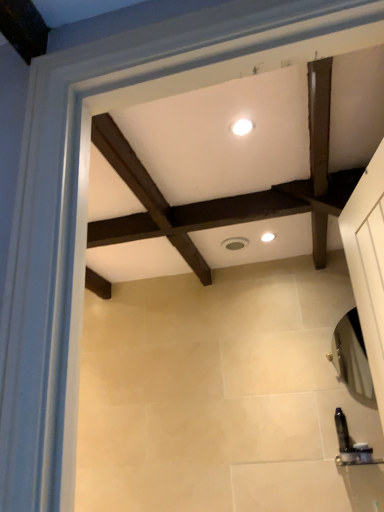
Describe the element at coordinates (363, 453) in the screenshot. I see `translucent plastic soap dispenser at lower right, which is the first toiletry from right to left` at that location.

Find the location of a particular element. black plastic toiletry at lower right, acting as the 2th toiletry starting from the right is located at coordinates (342, 431).

Measure the distance between white glossy light fixture at center, which is the 1th lighting from right to left, and camera.

A distance of 2.04 meters exists between white glossy light fixture at center, which is the 1th lighting from right to left, and camera.

Find the location of a particular element. translucent plastic soap dispenser at lower right, which is the first toiletry from right to left is located at coordinates coord(363,453).

At what (x,y) coordinates should I click in order to perform the action: click on the 1st toiletry in front of the white glossy light fixture at center, which is counted as the 1th lighting, starting from the back, counting from the anchor's position. Please return your answer as a coordinate pair (x, y). Looking at the image, I should click on (342, 431).

Considering the sizes of black plastic toiletry at lower right, acting as the 2th toiletry starting from the right, and white glossy light fixture at center, which is the 1th lighting from right to left, in the image, is black plastic toiletry at lower right, acting as the 2th toiletry starting from the right, taller or shorter than white glossy light fixture at center, which is the 1th lighting from right to left,?

In the image, black plastic toiletry at lower right, acting as the 2th toiletry starting from the right, appears to be taller than white glossy light fixture at center, which is the 1th lighting from right to left.

From a real-world perspective, is black plastic toiletry at lower right, acting as the 1th toiletry starting from the left, physically located above or below white glossy light fixture at center, the 1th lighting when ordered from bottom to top?

black plastic toiletry at lower right, acting as the 1th toiletry starting from the left, is below white glossy light fixture at center, the 1th lighting when ordered from bottom to top.

Is white glossy light fixture at center, the second lighting when ordered from top to bottom, completely or partially inside translucent plastic soap dispenser at lower right, which is the first toiletry from right to left?

Definitely not — white glossy light fixture at center, the second lighting when ordered from top to bottom, is not inside translucent plastic soap dispenser at lower right, which is the first toiletry from right to left.

Does translucent plastic soap dispenser at lower right, which is the first toiletry from right to left, have a lesser width compared to white glossy light fixture at center, which is the 1th lighting from right to left?

Yes.

Is white glossy light fixture at upper center, acting as the first lighting starting from the front, not near white glossy light fixture at center, the second lighting from the left?

No, there isn't a large distance between white glossy light fixture at upper center, acting as the first lighting starting from the front, and white glossy light fixture at center, the second lighting from the left.

In order to click on lighting in front of the white glossy light fixture at center, the 1th lighting when ordered from bottom to top in this screenshot , I will do `click(242, 127)`.

From a real-world perspective, which object rests below the other?

From a 3D spatial view, white glossy light fixture at center, the second lighting from the left, is below.

From the image's perspective, between white glossy light fixture at upper center, the 2th lighting from the right, and white glossy light fixture at center, the second lighting viewed from the front, which one is located above?

From the image's view, white glossy light fixture at upper center, the 2th lighting from the right, is above.

Between black plastic toiletry at lower right, acting as the 2th toiletry starting from the right, and translucent plastic soap dispenser at lower right, which is the first toiletry from right to left, which one appears on the left side from the viewer's perspective?

From the viewer's perspective, black plastic toiletry at lower right, acting as the 2th toiletry starting from the right, appears more on the left side.

From a real-world perspective, is black plastic toiletry at lower right, acting as the 2th toiletry starting from the right, positioned above or below translucent plastic soap dispenser at lower right, which is the first toiletry from right to left?

black plastic toiletry at lower right, acting as the 2th toiletry starting from the right, is situated higher than translucent plastic soap dispenser at lower right, which is the first toiletry from right to left, in the real world.

What's the angular difference between black plastic toiletry at lower right, acting as the 1th toiletry starting from the left, and white glossy light fixture at upper center, the second lighting in the bottom-to-top sequence,'s facing directions?

They differ by 0.463 degrees in their facing directions.

Which is in front, point (336, 421) or point (239, 129)?

The point (239, 129) is in front.

Is black plastic toiletry at lower right, acting as the 2th toiletry starting from the right, situated inside white glossy light fixture at upper center, the 2th lighting from the right, or outside?

black plastic toiletry at lower right, acting as the 2th toiletry starting from the right, is not inside white glossy light fixture at upper center, the 2th lighting from the right, it's outside.

Between black plastic toiletry at lower right, acting as the 2th toiletry starting from the right, and white glossy light fixture at upper center, placed as the 1th lighting when sorted from top to bottom, which one appears on the right side from the viewer's perspective?

From the viewer's perspective, black plastic toiletry at lower right, acting as the 2th toiletry starting from the right, appears more on the right side.

Considering the relative sizes of white glossy light fixture at center, which is the 1th lighting from right to left, and black plastic toiletry at lower right, acting as the 1th toiletry starting from the left, in the image provided, is white glossy light fixture at center, which is the 1th lighting from right to left, shorter than black plastic toiletry at lower right, acting as the 1th toiletry starting from the left,?

Indeed, white glossy light fixture at center, which is the 1th lighting from right to left, has a lesser height compared to black plastic toiletry at lower right, acting as the 1th toiletry starting from the left.

Is white glossy light fixture at center, which is counted as the 1th lighting, starting from the back, wider or thinner than black plastic toiletry at lower right, acting as the 1th toiletry starting from the left?

white glossy light fixture at center, which is counted as the 1th lighting, starting from the back, is wider than black plastic toiletry at lower right, acting as the 1th toiletry starting from the left.

From the image's perspective, is white glossy light fixture at center, the second lighting viewed from the front, on black plastic toiletry at lower right, acting as the 1th toiletry starting from the left?

Yes, from the image's perspective, white glossy light fixture at center, the second lighting viewed from the front, is on top of black plastic toiletry at lower right, acting as the 1th toiletry starting from the left.

This screenshot has height=512, width=384. Find the location of `toiletry that is the 1st one below the white glossy light fixture at center, the second lighting viewed from the front (from a real-world perspective)`. toiletry that is the 1st one below the white glossy light fixture at center, the second lighting viewed from the front (from a real-world perspective) is located at coordinates (342, 431).

From the image's perspective, is white glossy light fixture at center, which is the 1th lighting from right to left, on white glossy light fixture at upper center, the second lighting in the back-to-front sequence?

No.

Is white glossy light fixture at upper center, acting as the first lighting starting from the front, a part of white glossy light fixture at center, which is counted as the 1th lighting, starting from the back?

That's incorrect, white glossy light fixture at upper center, acting as the first lighting starting from the front, is not inside white glossy light fixture at center, which is counted as the 1th lighting, starting from the back.

I want to click on lighting in front of the white glossy light fixture at center, the second lighting viewed from the front, so (x=242, y=127).

Is white glossy light fixture at center, the second lighting when ordered from top to bottom, looking in the opposite direction of white glossy light fixture at upper center, positioned as the 1th lighting in left-to-right order?

That's not correct — white glossy light fixture at center, the second lighting when ordered from top to bottom, is not looking away from white glossy light fixture at upper center, positioned as the 1th lighting in left-to-right order.

The image size is (384, 512). Identify the location of toiletry that is the 1st object directly below the white glossy light fixture at center, the second lighting when ordered from top to bottom (from a real-world perspective). (342, 431).

Which toiletry is the 2nd one when counting from the front of the white glossy light fixture at center, which is counted as the 1th lighting, starting from the back? Please provide its 2D coordinates.

[(363, 453)]

Considering their positions, is black plastic toiletry at lower right, acting as the 2th toiletry starting from the right, positioned closer to white glossy light fixture at upper center, positioned as the 1th lighting in left-to-right order, than translucent plastic soap dispenser at lower right, which appears as the 2th toiletry when viewed from the left?

black plastic toiletry at lower right, acting as the 2th toiletry starting from the right, is positioned closer to the anchor white glossy light fixture at upper center, positioned as the 1th lighting in left-to-right order.

Considering their positions, is white glossy light fixture at center, the second lighting from the left, positioned further to translucent plastic soap dispenser at lower right, which is the first toiletry from right to left, than white glossy light fixture at upper center, the second lighting in the back-to-front sequence?

white glossy light fixture at upper center, the second lighting in the back-to-front sequence, is further to translucent plastic soap dispenser at lower right, which is the first toiletry from right to left.

When comparing their distances from white glossy light fixture at upper center, placed as the 1th lighting when sorted from top to bottom, does black plastic toiletry at lower right, acting as the 2th toiletry starting from the right, or white glossy light fixture at center, which is counted as the 1th lighting, starting from the back, seem closer?

white glossy light fixture at center, which is counted as the 1th lighting, starting from the back, lies closer to white glossy light fixture at upper center, placed as the 1th lighting when sorted from top to bottom, than the other object.

Based on the photo, estimate the real-world distances between objects in this image. Which object is closer to black plastic toiletry at lower right, acting as the 2th toiletry starting from the right, white glossy light fixture at center, the second lighting from the left, or translucent plastic soap dispenser at lower right, which is the first toiletry from right to left?

translucent plastic soap dispenser at lower right, which is the first toiletry from right to left.

When comparing their distances from translucent plastic soap dispenser at lower right, which appears as the 2th toiletry when viewed from the left, does black plastic toiletry at lower right, acting as the 1th toiletry starting from the left, or white glossy light fixture at upper center, the second lighting in the bottom-to-top sequence, seem further?

The object further to translucent plastic soap dispenser at lower right, which appears as the 2th toiletry when viewed from the left, is white glossy light fixture at upper center, the second lighting in the bottom-to-top sequence.

Based on their spatial positions, is black plastic toiletry at lower right, acting as the 1th toiletry starting from the left, or translucent plastic soap dispenser at lower right, which appears as the 2th toiletry when viewed from the left, closer to white glossy light fixture at center, the second lighting from the left?

The object closer to white glossy light fixture at center, the second lighting from the left, is black plastic toiletry at lower right, acting as the 1th toiletry starting from the left.

Based on their spatial positions, is white glossy light fixture at upper center, the second lighting in the back-to-front sequence, or white glossy light fixture at center, the second lighting from the left, closer to translucent plastic soap dispenser at lower right, which is the first toiletry from right to left?

Based on the image, white glossy light fixture at center, the second lighting from the left, appears to be nearer to translucent plastic soap dispenser at lower right, which is the first toiletry from right to left.

Based on their spatial positions, is white glossy light fixture at upper center, the second lighting in the back-to-front sequence, or translucent plastic soap dispenser at lower right, which is the first toiletry from right to left, further from white glossy light fixture at center, which is counted as the 1th lighting, starting from the back?

translucent plastic soap dispenser at lower right, which is the first toiletry from right to left, is positioned further to the anchor white glossy light fixture at center, which is counted as the 1th lighting, starting from the back.

Locate an element on the screen. This screenshot has width=384, height=512. toiletry that lies between white glossy light fixture at upper center, the second lighting in the back-to-front sequence, and translucent plastic soap dispenser at lower right, which appears as the 2th toiletry when viewed from the left, from top to bottom is located at coordinates (342, 431).

Identify the location of toiletry between white glossy light fixture at center, the 1th lighting when ordered from bottom to top, and translucent plastic soap dispenser at lower right, which appears as the 2th toiletry when viewed from the left, in the up-down direction. (342, 431).

The height and width of the screenshot is (512, 384). What are the coordinates of `lighting between white glossy light fixture at upper center, the second lighting in the back-to-front sequence, and black plastic toiletry at lower right, acting as the 1th toiletry starting from the left, in the up-down direction` in the screenshot? It's located at (268, 237).

Locate an element on the screen. The width and height of the screenshot is (384, 512). lighting between white glossy light fixture at upper center, placed as the 1th lighting when sorted from top to bottom, and translucent plastic soap dispenser at lower right, which is the first toiletry from right to left, from top to bottom is located at coordinates 268,237.